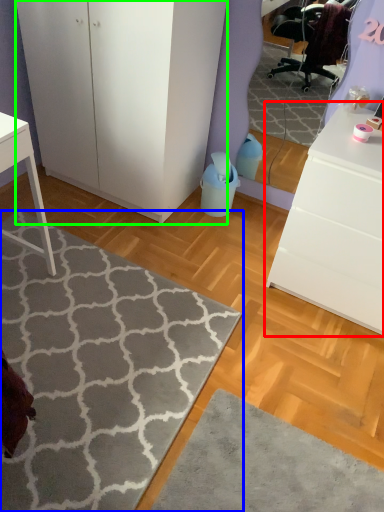
Question: Based on their relative distances, which object is farther from chest of drawers (highlighted by a red box)? Choose from doormat (highlighted by a blue box) and cabinetry (highlighted by a green box).

Choices:
 (A) doormat
 (B) cabinetry

Answer: (B)